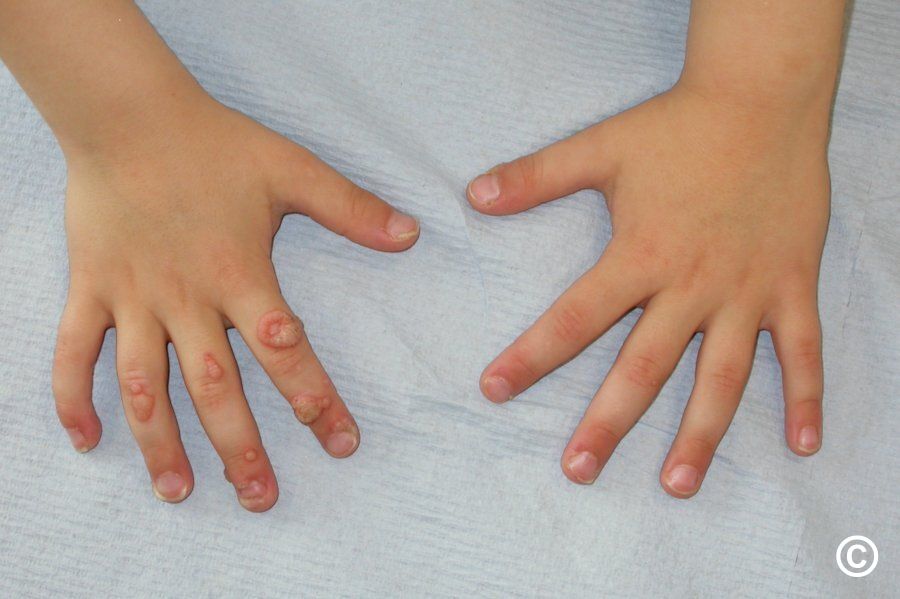
This screenshot has height=599, width=900. Find the location of `paper towel`. paper towel is located at coordinates (356, 166), (361, 332).